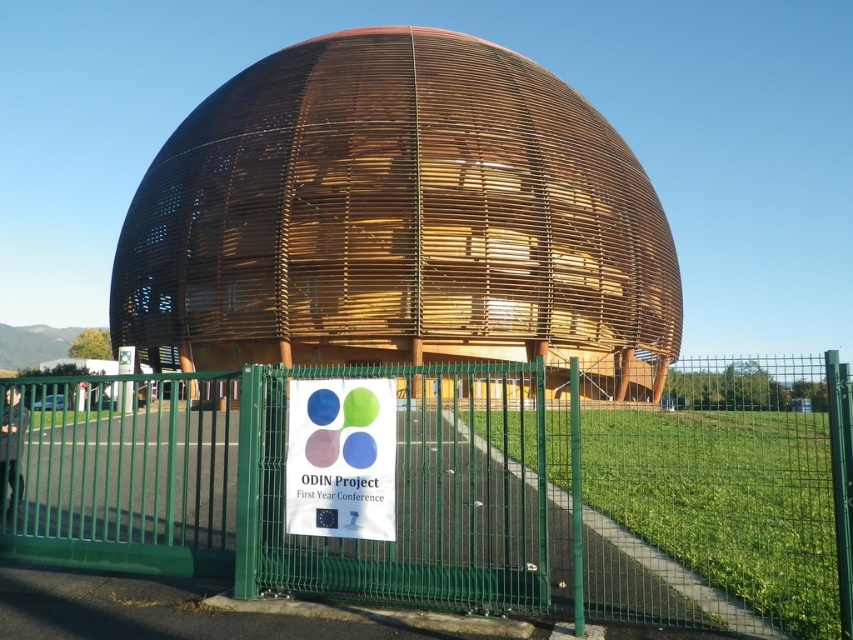
Question: Can you confirm if green metal fence at center is positioned above wooden at center?

Choices:
 (A) yes
 (B) no

Answer: (B)

Question: From the image, what is the correct spatial relationship of wooden at center in relation to matte plastic sign at center?

Choices:
 (A) right
 (B) left

Answer: (B)

Question: Which of these objects is positioned farthest from the green metal fence at center?

Choices:
 (A) wooden at center
 (B) matte plastic sign at center

Answer: (B)

Question: Which point is farther to the camera?

Choices:
 (A) tap(764, 499)
 (B) tap(329, 468)

Answer: (A)

Question: Which point is farther to the camera?

Choices:
 (A) matte plastic sign at center
 (B) green metal fence at center

Answer: (A)

Question: Does green metal fence at center appear under wooden at center?

Choices:
 (A) no
 (B) yes

Answer: (B)